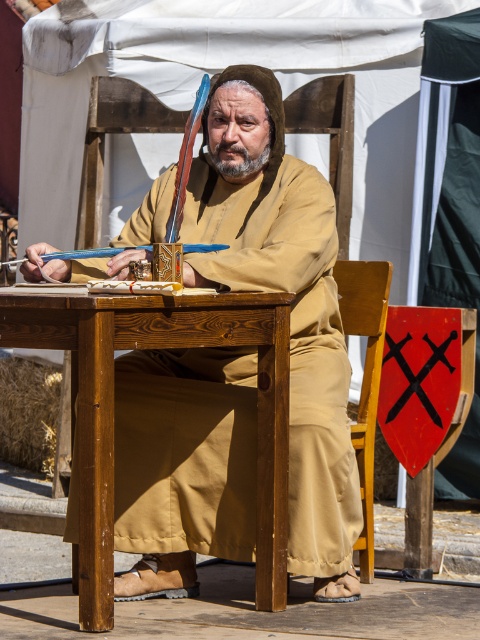
Question: Which point appears closest to the camera in this image?

Choices:
 (A) (178, 365)
 (B) (44, 324)

Answer: (B)

Question: Among these points, which one is nearest to the camera?

Choices:
 (A) (313, 435)
 (B) (362, 486)

Answer: (A)

Question: Is wooden table at center thinner than wooden chair at center?

Choices:
 (A) no
 (B) yes

Answer: (A)

Question: Which of these objects is positioned closest to the wooden chair at center?

Choices:
 (A) wooden table at center
 (B) brown clothed man at center

Answer: (B)

Question: Does brown clothed man at center have a greater width compared to wooden chair at center?

Choices:
 (A) yes
 (B) no

Answer: (A)

Question: Can you confirm if brown clothed man at center is positioned below wooden chair at center?

Choices:
 (A) no
 (B) yes

Answer: (A)